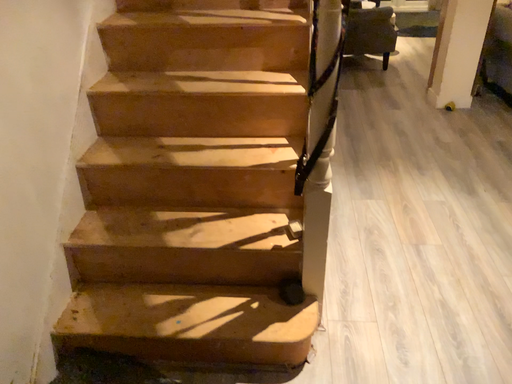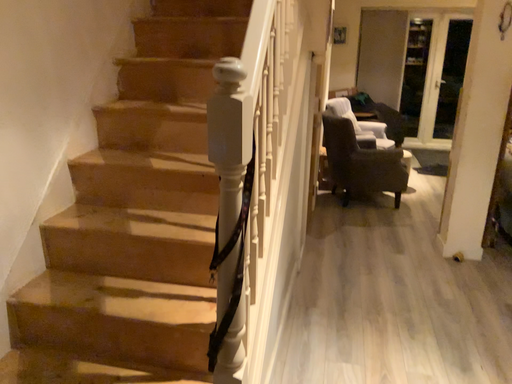
Question: Which way did the camera rotate in the video?

Choices:
 (A) rotated downward
 (B) rotated upward

Answer: (B)